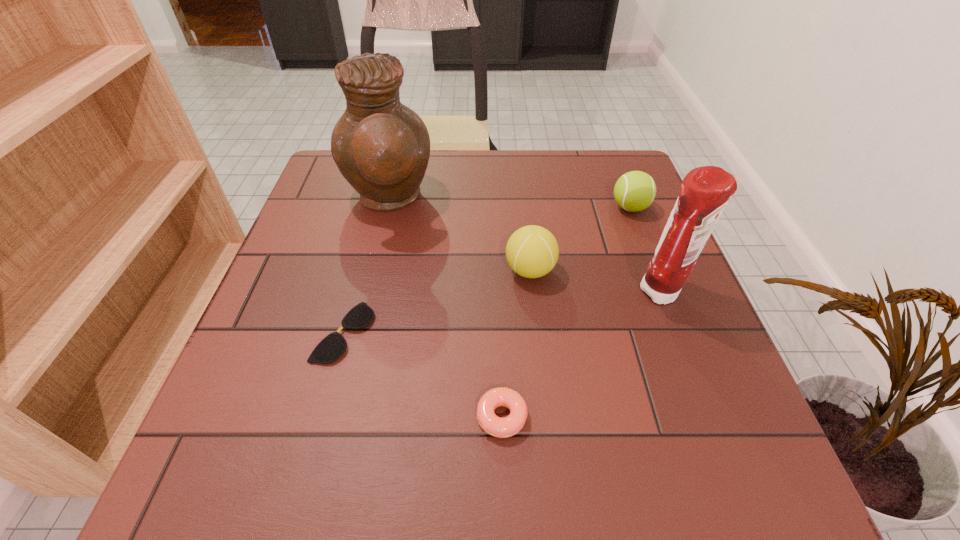
You are a GUI agent. You are given a task and a screenshot of the screen. Output one action in this format:
    pyautogui.click(x=<x>, y=<y>)
    Task: Click on the free spot that satisfies the following two spatial constraints: 1. at the spout of the tallest object; 2. on the right side of the right tennis ball
    
    Given the screenshot: What is the action you would take?
    pyautogui.click(x=387, y=207)

Identify the location of free space that satisfies the following two spatial constraints: 1. on the front side of the second tallest object; 2. on the left side of the left tennis ball. (533, 293).